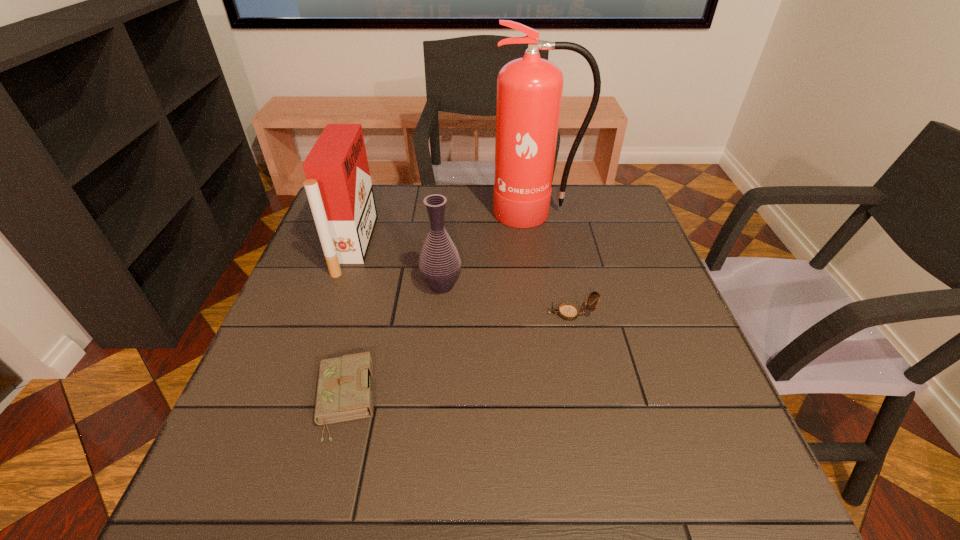
What are the coordinates of `vacant space at the far edge` in the screenshot? It's located at (441, 190).

In order to click on vacant space at the near edge in this screenshot , I will do `click(575, 480)`.

In the image, there is a desktop. Identify the location of vacant space at the left edge. The width and height of the screenshot is (960, 540). (316, 258).

Find the location of a particular element. blank area at the right edge is located at coordinates (624, 272).

You are a GUI agent. You are given a task and a screenshot of the screen. Output one action in this format:
    pyautogui.click(x=<x>, y=<y>)
    Task: Click on the vacant space at the far left corner of the desktop
    The width and height of the screenshot is (960, 540).
    Given the screenshot: What is the action you would take?
    pyautogui.click(x=377, y=209)

The height and width of the screenshot is (540, 960). What are the coordinates of `blank space at the near left corner of the desktop` in the screenshot? It's located at (224, 495).

At what (x,y) coordinates should I click in order to perform the action: click on vacant space at the far right corner of the desktop. Please return your answer as a coordinate pair (x, y). This screenshot has width=960, height=540. Looking at the image, I should click on (592, 216).

Locate an element on the screen. This screenshot has width=960, height=540. empty location between the fire extinguisher and the diary is located at coordinates (441, 306).

Image resolution: width=960 pixels, height=540 pixels. What are the coordinates of `vacant space in between the fire extinguisher and the third object from left to right` in the screenshot? It's located at (489, 249).

Locate an element on the screen. The image size is (960, 540). unoccupied area between the tallest object and the nearest object is located at coordinates (441, 306).